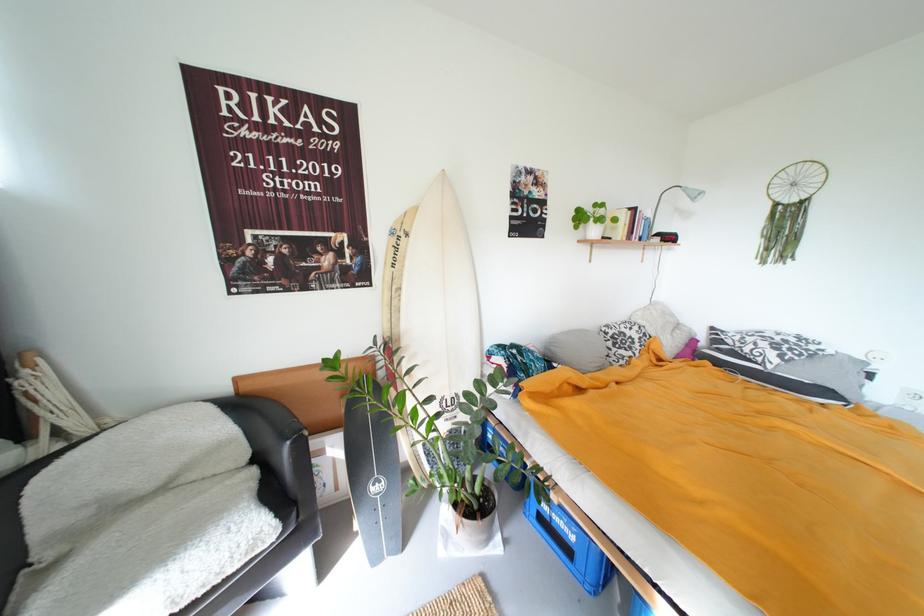
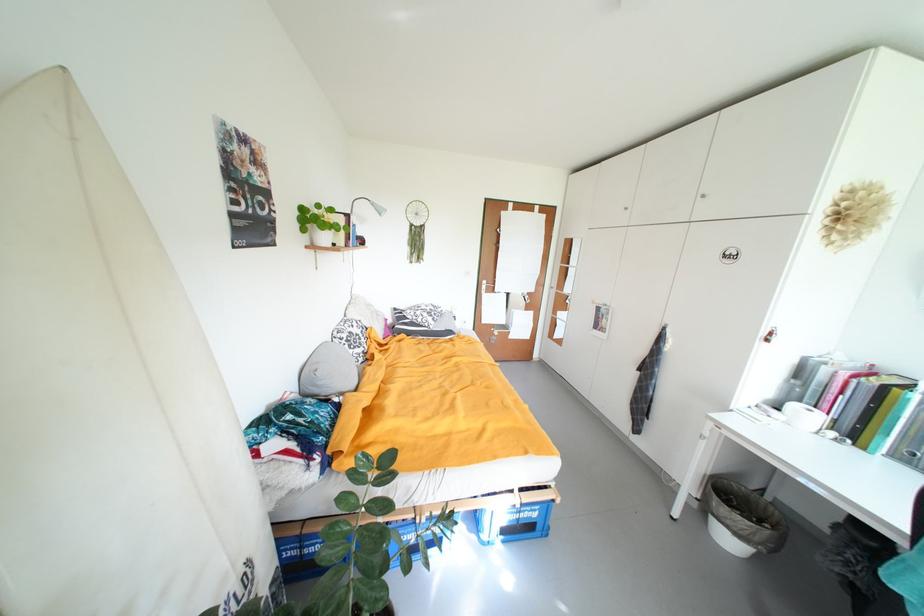
Question: I am providing you with two images of the same scene from different viewpoints. Which of the following objects are not visible in image2?

Choices:
 (A) patterned pillow
 (B) white ceramic cup
 (C) white surfboard
 (D) none of these

Answer: (D)